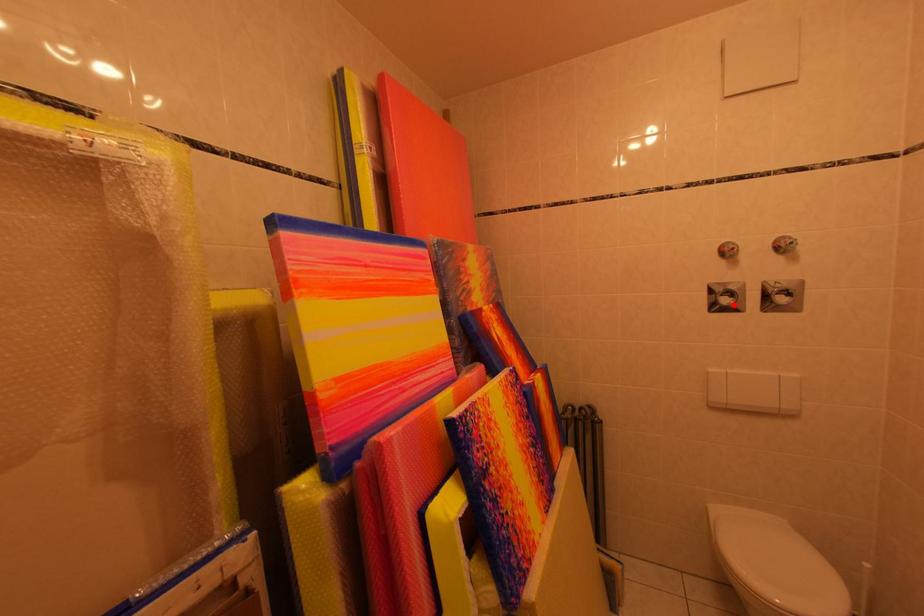
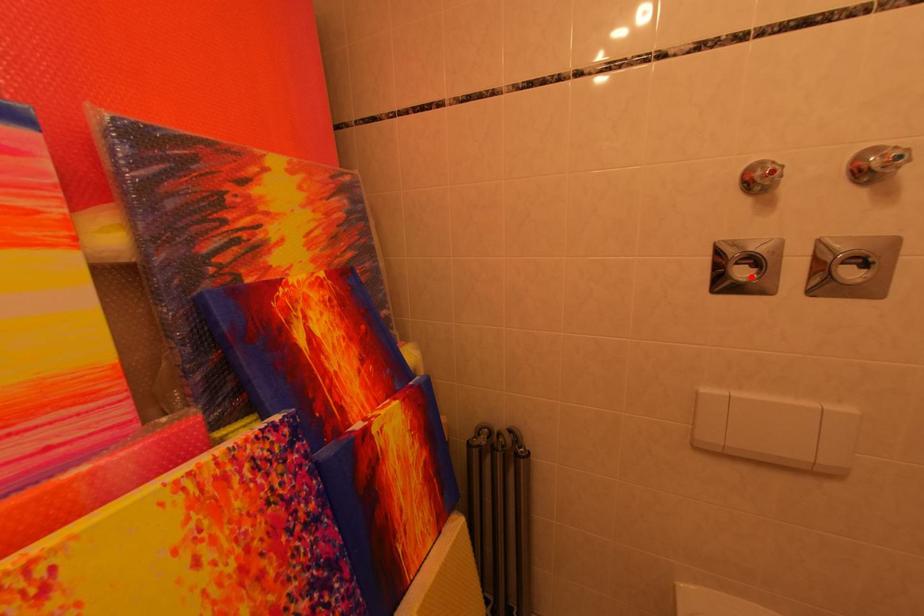
I am providing you with two images of the same scene from different viewpoints. A red point is marked on the first image and another point is marked on the second image. Is the marked point in image1 the same physical position as the marked point in image2?

Yes